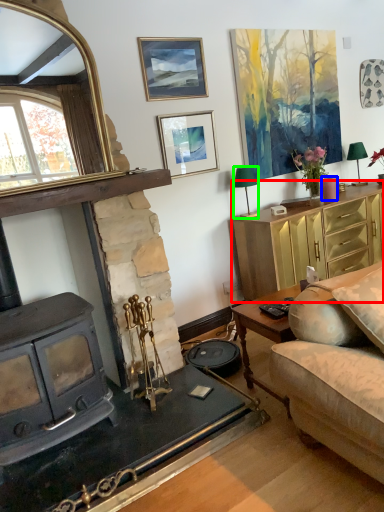
Question: Which is farther away from cabinetry (highlighted by a red box)? candle (highlighted by a blue box) or lamp (highlighted by a green box)?

Choices:
 (A) candle
 (B) lamp

Answer: (B)